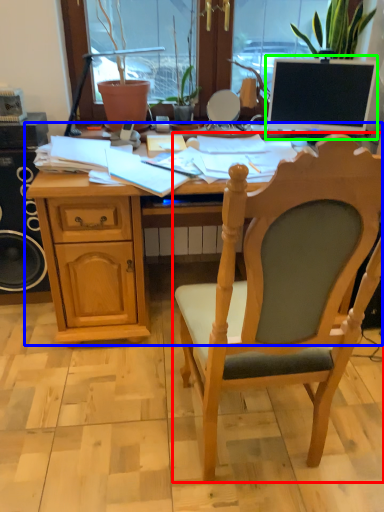
Question: Which is farther away from chair (highlighted by a red box)? desk (highlighted by a blue box) or computer monitor (highlighted by a green box)?

Choices:
 (A) desk
 (B) computer monitor

Answer: (B)